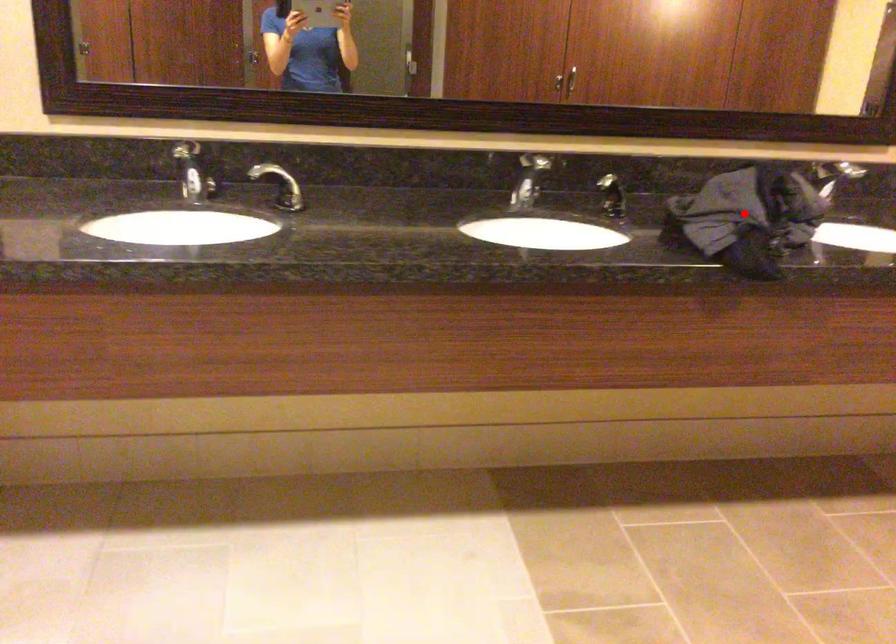
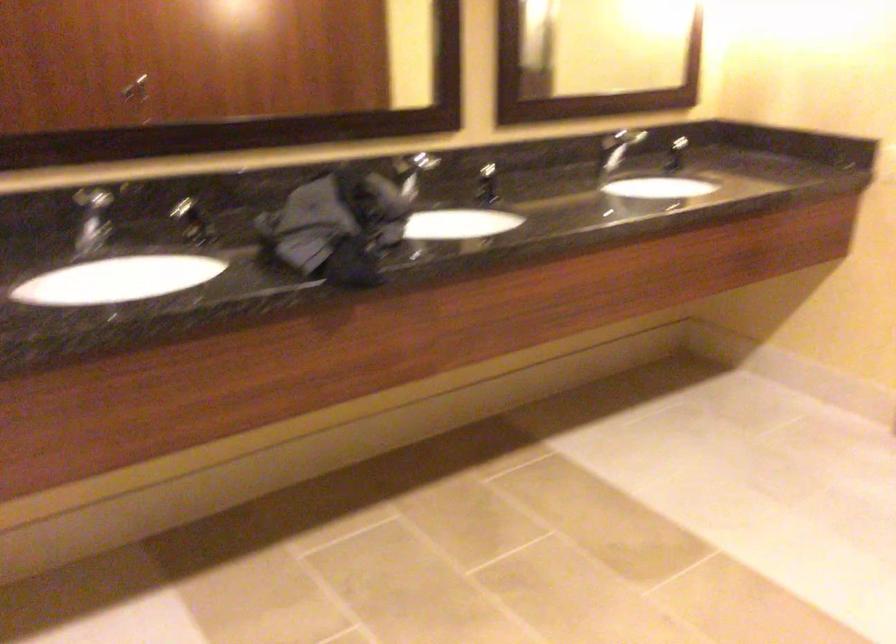
Where in the second image is the point corresponding to the highlighted location from the first image?

(337, 227)